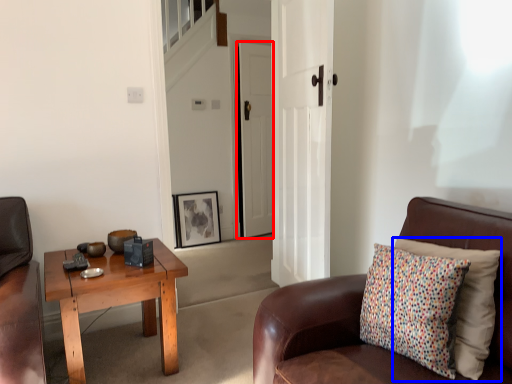
Question: Which point is further to the camera, door (highlighted by a red box) or pillow (highlighted by a blue box)?

Choices:
 (A) door
 (B) pillow

Answer: (A)